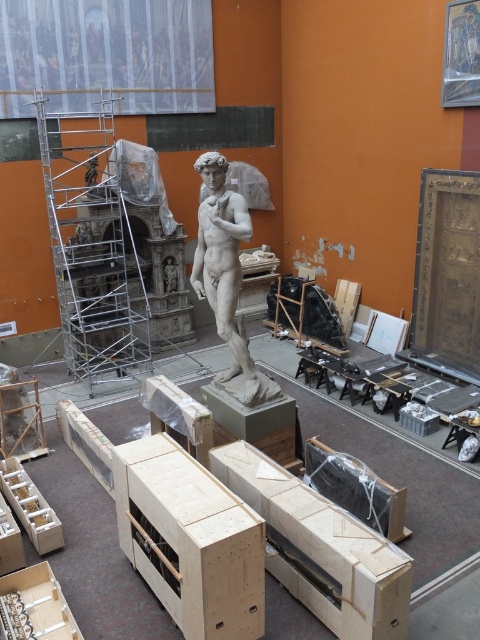
Question: Which point is farther to the camera?

Choices:
 (A) white marble statue at center
 (B) silver metallic scaffolding at left

Answer: (B)

Question: Is silver metallic scaffolding at left further to camera compared to white marble statue at center?

Choices:
 (A) no
 (B) yes

Answer: (B)

Question: Can you confirm if silver metallic scaffolding at left is thinner than white marble statue at center?

Choices:
 (A) yes
 (B) no

Answer: (B)

Question: Which of the following is the closest to the observer?

Choices:
 (A) white marble statue at center
 (B) silver metallic scaffolding at left

Answer: (A)

Question: Which of the following is the closest to the observer?

Choices:
 (A) (267, 396)
 (B) (64, 353)

Answer: (A)

Question: Is the position of silver metallic scaffolding at left less distant than that of white marble statue at center?

Choices:
 (A) yes
 (B) no

Answer: (B)